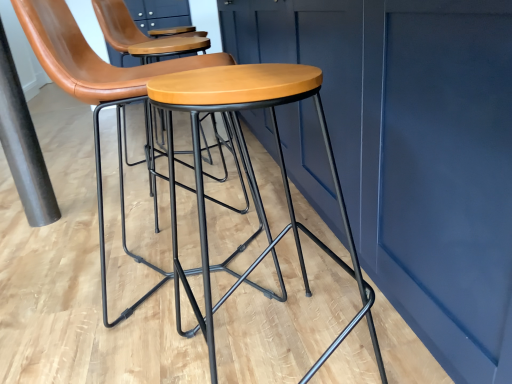
Question: Is black matte pole at left positioned with its back to matte wood stool at center?

Choices:
 (A) no
 (B) yes

Answer: (A)

Question: Does black matte pole at left have a greater height compared to matte wood stool at center?

Choices:
 (A) yes
 (B) no

Answer: (A)

Question: Considering the relative positions of black matte pole at left and matte wood stool at center in the image provided, is black matte pole at left to the left of matte wood stool at center from the viewer's perspective?

Choices:
 (A) no
 (B) yes

Answer: (B)

Question: Can you confirm if black matte pole at left is wider than matte wood stool at center?

Choices:
 (A) yes
 (B) no

Answer: (B)

Question: From a real-world perspective, does black matte pole at left sit lower than matte wood stool at center?

Choices:
 (A) no
 (B) yes

Answer: (A)

Question: From a real-world perspective, is matte wood stool at center above or below black matte pole at left?

Choices:
 (A) above
 (B) below

Answer: (B)

Question: Is matte wood stool at center situated inside black matte pole at left or outside?

Choices:
 (A) inside
 (B) outside

Answer: (B)

Question: In terms of height, does matte wood stool at center look taller or shorter compared to black matte pole at left?

Choices:
 (A) tall
 (B) short

Answer: (B)

Question: From the image's perspective, is matte wood stool at center above or below black matte pole at left?

Choices:
 (A) above
 (B) below

Answer: (B)

Question: From their relative heights in the image, would you say matte brown leather stool at center is taller or shorter than matte wood stool at center?

Choices:
 (A) tall
 (B) short

Answer: (A)

Question: Considering the positions of matte brown leather stool at center and matte wood stool at center in the image, is matte brown leather stool at center bigger or smaller than matte wood stool at center?

Choices:
 (A) big
 (B) small

Answer: (A)

Question: Is point (62, 62) closer or farther from the camera than point (178, 286)?

Choices:
 (A) farther
 (B) closer

Answer: (B)

Question: Considering the relative positions of matte brown leather stool at center and matte wood stool at center in the image provided, is matte brown leather stool at center to the left or to the right of matte wood stool at center?

Choices:
 (A) right
 (B) left

Answer: (B)

Question: From the image's perspective, is matte brown leather stool at center above or below black matte pole at left?

Choices:
 (A) above
 (B) below

Answer: (B)

Question: Would you say matte brown leather stool at center is to the left or to the right of black matte pole at left in the picture?

Choices:
 (A) left
 (B) right

Answer: (B)